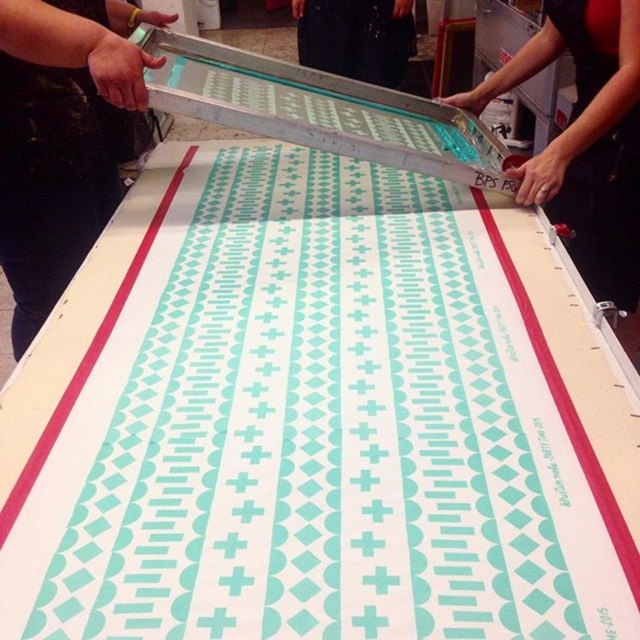
You are an assistant who needs to locate the point marked at coordinates [586,140] in the scene. Which object is this point located on?

The point marked at coordinates [586,140] is located on the metallic silver tool at upper center.

Where is the metallic silver tool at upper center located in the image?

The metallic silver tool at upper center is located at point [586,140] in the image.

You are an assistant helping to prepare materials for an art class. You have a black fabric at upper left and a metallic silver tool at upper center. The teacher asks you to place both items on a shelf that can only hold items up to the width of the widest item. Which item should you place first to ensure both fit?

The black fabric at upper left is wider than the metallic silver tool at upper center, so you should place the black fabric at upper left first to ensure both items fit on the shelf.